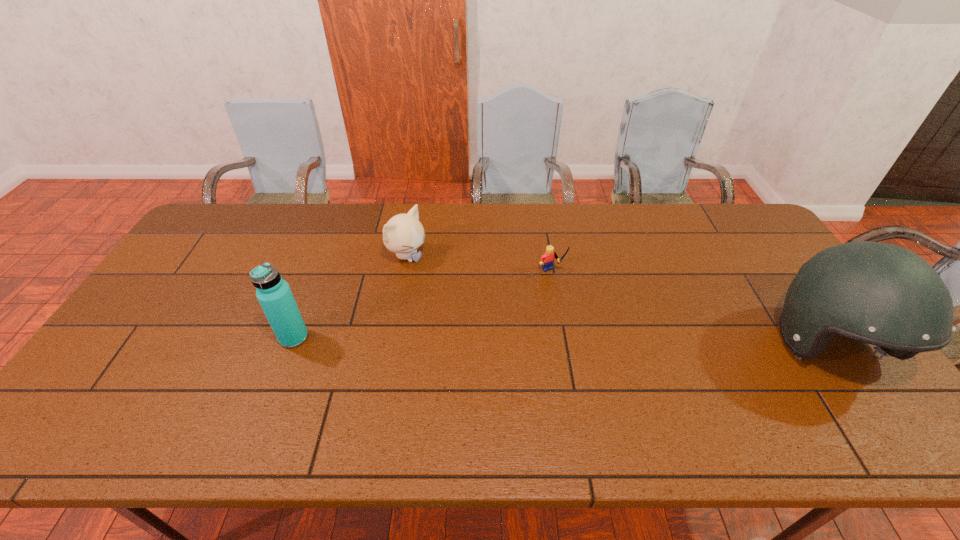
At what (x,y) coordinates should I click in order to perform the action: click on vacant space at the near edge of the desktop. Please return your answer as a coordinate pair (x, y). The height and width of the screenshot is (540, 960). Looking at the image, I should click on (326, 399).

Where is `vacant region at the left edge of the desktop`? The image size is (960, 540). vacant region at the left edge of the desktop is located at coordinates (136, 347).

Identify the location of vacant space at the right edge. The width and height of the screenshot is (960, 540). (761, 265).

At what (x,y) coordinates should I click in order to perform the action: click on free space at the far right corner of the desktop. Please return your answer as a coordinate pair (x, y). Image resolution: width=960 pixels, height=540 pixels. Looking at the image, I should click on (748, 226).

The width and height of the screenshot is (960, 540). I want to click on free space between the shortest object and the second shortest object, so click(479, 264).

Identify the location of unoccupied position between the second shortest object and the shortest object. (479, 264).

Identify the location of free spot between the football helmet and the second object from left to right. This screenshot has height=540, width=960. (618, 301).

Locate an element on the screen. This screenshot has width=960, height=540. vacant area that lies between the second tallest object and the football helmet is located at coordinates (561, 342).

The width and height of the screenshot is (960, 540). I want to click on free space that is in between the second tallest object and the Lego, so click(422, 305).

Locate an element on the screen. The image size is (960, 540). free space between the tallest object and the second object from left to right is located at coordinates (618, 301).